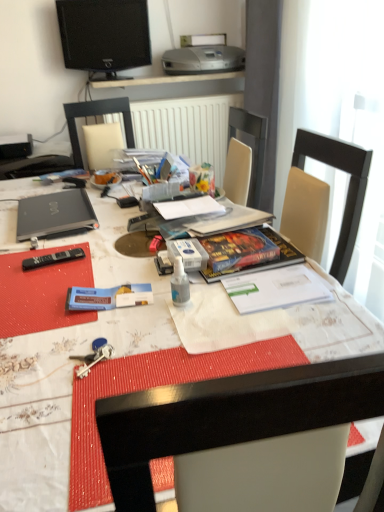
Where is `vacant area that is in front of black plastic remote control at lower left`? The width and height of the screenshot is (384, 512). vacant area that is in front of black plastic remote control at lower left is located at coordinates (42, 286).